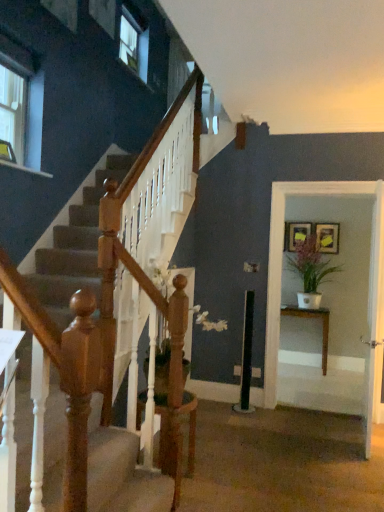
At what (x,y) coordinates should I click in order to perform the action: click on vacant space in front of white glossy door at center. Please return your answer as a coordinate pair (x, y). This screenshot has height=512, width=384. Looking at the image, I should click on (354, 470).